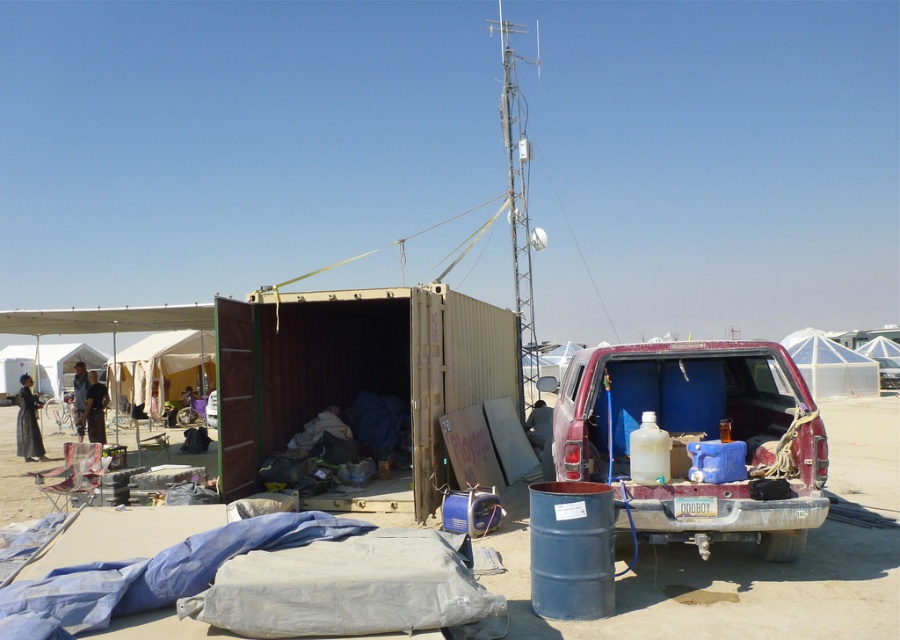
Is rustic wood van at rear taller than transparent dome at upper right?

Incorrect, rustic wood van at rear's height is not larger of transparent dome at upper right's.

Is rustic wood van at rear positioned behind transparent dome at upper right?

That is False.

Is point (804, 387) behind point (840, 346)?

No, it is not.

Locate an element on the screen. rustic wood van at rear is located at coordinates (698, 440).

Is point (664, 392) in front of point (74, 372)?

Yes, point (664, 392) is in front of point (74, 372).

Is rustic wood van at rear positioned behind dark gray fabric at center?

No, rustic wood van at rear is in front of dark gray fabric at center.

In the scene shown: Who is more distant from viewer, [778,516] or [78,371]?

The point [78,371] is behind.

Identify the location of rustic wood van at rear. (698, 440).

Is dirt field at lower center smaller than white canvas tent at lower left?

Correct, dirt field at lower center occupies less space than white canvas tent at lower left.

Is dirt field at lower center shorter than white canvas tent at lower left?

Correct, dirt field at lower center is not as tall as white canvas tent at lower left.

Which is behind, point (815, 548) or point (6, 349)?

Positioned behind is point (6, 349).

Image resolution: width=900 pixels, height=640 pixels. I want to click on dirt field at lower center, so 723,588.